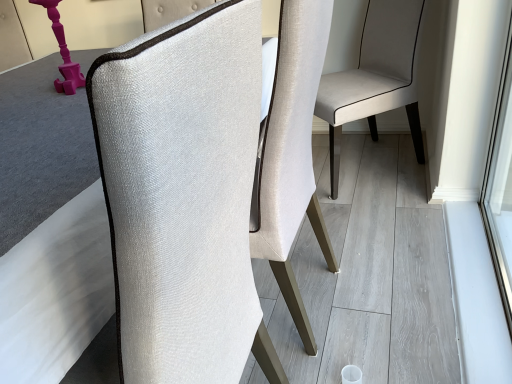
The width and height of the screenshot is (512, 384). What are the coordinates of `matte pink plastic table lamp at left` in the screenshot? It's located at (62, 52).

Image resolution: width=512 pixels, height=384 pixels. Identify the location of textured beige chair at center, which ranks as the 1th chair in back-to-front order. (376, 77).

Find the location of a particular element. This screenshot has width=512, height=384. matte pink plastic table lamp at left is located at coordinates (62, 52).

Considering the relative sizes of textured fabric chair at center, placed as the 1th chair when sorted from front to back, and textured beige chair at center, placed as the second chair when sorted from front to back, in the image provided, is textured fabric chair at center, placed as the 1th chair when sorted from front to back, taller than textured beige chair at center, placed as the second chair when sorted from front to back,?

Indeed, textured fabric chair at center, placed as the 1th chair when sorted from front to back, has a greater height compared to textured beige chair at center, placed as the second chair when sorted from front to back.

How far apart are textured fabric chair at center, the second chair positioned from the back, and textured beige chair at center, placed as the second chair when sorted from front to back?

textured fabric chair at center, the second chair positioned from the back, is 39.12 inches from textured beige chair at center, placed as the second chair when sorted from front to back.

How many degrees apart are the facing directions of textured fabric chair at center, the second chair positioned from the back, and textured beige chair at center, which ranks as the 1th chair in back-to-front order?

The angle between the facing direction of textured fabric chair at center, the second chair positioned from the back, and the facing direction of textured beige chair at center, which ranks as the 1th chair in back-to-front order, is 40.5 degrees.

Locate an element on the screen. The height and width of the screenshot is (384, 512). chair behind the textured fabric chair at center, the second chair positioned from the back is located at coordinates (376, 77).

Locate an element on the screen. chair above the matte pink plastic table lamp at left (from the image's perspective) is located at coordinates (376, 77).

Considering the sizes of objects textured beige chair at center, which ranks as the 1th chair in back-to-front order, and matte pink plastic table lamp at left in the image provided, who is shorter, textured beige chair at center, which ranks as the 1th chair in back-to-front order, or matte pink plastic table lamp at left?

matte pink plastic table lamp at left.

Which is less distant, (336, 180) or (70, 91)?

Point (336, 180) appears to be farther away from the viewer than point (70, 91).

Consider the image. Is textured fabric chair at center, the second chair positioned from the back, looking in the opposite direction of matte pink plastic table lamp at left?

No.

Who is bigger, textured fabric chair at center, placed as the 1th chair when sorted from front to back, or matte pink plastic table lamp at left?

With larger size is textured fabric chair at center, placed as the 1th chair when sorted from front to back.

Are textured fabric chair at center, the second chair positioned from the back, and matte pink plastic table lamp at left far apart?

They are positioned close to each other.

Is textured fabric chair at center, the second chair positioned from the back, spatially inside matte pink plastic table lamp at left, or outside of it?

textured fabric chair at center, the second chair positioned from the back, is located beyond the bounds of matte pink plastic table lamp at left.

Are matte pink plastic table lamp at left and textured fabric chair at center, placed as the 1th chair when sorted from front to back, far apart?

That's not correct — matte pink plastic table lamp at left is a little close to textured fabric chair at center, placed as the 1th chair when sorted from front to back.

From the image's perspective, does matte pink plastic table lamp at left appear higher than textured fabric chair at center, the second chair positioned from the back?

Correct, matte pink plastic table lamp at left appears higher than textured fabric chair at center, the second chair positioned from the back, in the image.

Is matte pink plastic table lamp at left not within textured fabric chair at center, the second chair positioned from the back?

matte pink plastic table lamp at left lies outside textured fabric chair at center, the second chair positioned from the back,'s area.

Find the location of a particular element. Image resolution: width=512 pixels, height=384 pixels. chair in front of the matte pink plastic table lamp at left is located at coordinates (203, 187).

From the image's perspective, is textured beige chair at center, placed as the second chair when sorted from front to back, above or below textured fabric chair at center, placed as the 1th chair when sorted from front to back?

textured beige chair at center, placed as the second chair when sorted from front to back, is above textured fabric chair at center, placed as the 1th chair when sorted from front to back.

Is point (379, 24) farther from camera compared to point (118, 90)?

Yes, point (379, 24) is farther from viewer.

Between textured beige chair at center, placed as the second chair when sorted from front to back, and textured fabric chair at center, the second chair positioned from the back, which one has smaller size?

Smaller between the two is textured fabric chair at center, the second chair positioned from the back.

Would you say textured beige chair at center, placed as the second chair when sorted from front to back, is to the left or to the right of textured fabric chair at center, the second chair positioned from the back, in the picture?

In the image, textured beige chair at center, placed as the second chair when sorted from front to back, appears on the right side of textured fabric chair at center, the second chair positioned from the back.

Is matte pink plastic table lamp at left taller than textured beige chair at center, placed as the second chair when sorted from front to back?

Incorrect, the height of matte pink plastic table lamp at left is not larger of that of textured beige chair at center, placed as the second chair when sorted from front to back.

Does matte pink plastic table lamp at left have a smaller size compared to textured beige chair at center, placed as the second chair when sorted from front to back?

Yes.

You are a GUI agent. You are given a task and a screenshot of the screen. Output one action in this format:
    pyautogui.click(x=<x>, y=<y>)
    Task: Click on the 2nd chair to the right of the matte pink plastic table lamp at left, starting your count from the anchor
    The image size is (512, 384).
    Given the screenshot: What is the action you would take?
    pyautogui.click(x=376, y=77)

Relative to textured beige chair at center, placed as the second chair when sorted from front to back, is matte pink plastic table lamp at left in front or behind?

matte pink plastic table lamp at left is positioned closer to the viewer than textured beige chair at center, placed as the second chair when sorted from front to back.

You are a GUI agent. You are given a task and a screenshot of the screen. Output one action in this format:
    pyautogui.click(x=<x>, y=<y>)
    Task: Click on the chair located on the right of textured fabric chair at center, the second chair positioned from the back
    Image resolution: width=512 pixels, height=384 pixels.
    Given the screenshot: What is the action you would take?
    pyautogui.click(x=376, y=77)

The height and width of the screenshot is (384, 512). Identify the location of chair behind the matte pink plastic table lamp at left. (376, 77).

Estimate the real-world distances between objects in this image. Which object is further from matte pink plastic table lamp at left, textured beige chair at center, placed as the second chair when sorted from front to back, or textured fabric chair at center, the second chair positioned from the back?

textured beige chair at center, placed as the second chair when sorted from front to back, lies further to matte pink plastic table lamp at left than the other object.

Looking at the image, which one is located further to textured beige chair at center, which ranks as the 1th chair in back-to-front order, textured fabric chair at center, placed as the 1th chair when sorted from front to back, or matte pink plastic table lamp at left?

matte pink plastic table lamp at left lies further to textured beige chair at center, which ranks as the 1th chair in back-to-front order, than the other object.

From the image, which object appears to be nearer to textured beige chair at center, which ranks as the 1th chair in back-to-front order, matte pink plastic table lamp at left or textured fabric chair at center, placed as the 1th chair when sorted from front to back?

textured fabric chair at center, placed as the 1th chair when sorted from front to back, lies closer to textured beige chair at center, which ranks as the 1th chair in back-to-front order, than the other object.

From the image, which object appears to be nearer to textured fabric chair at center, placed as the 1th chair when sorted from front to back, matte pink plastic table lamp at left or textured beige chair at center, placed as the second chair when sorted from front to back?

matte pink plastic table lamp at left lies closer to textured fabric chair at center, placed as the 1th chair when sorted from front to back, than the other object.

When comparing their distances from textured fabric chair at center, placed as the 1th chair when sorted from front to back, does textured beige chair at center, which ranks as the 1th chair in back-to-front order, or matte pink plastic table lamp at left seem closer?

matte pink plastic table lamp at left is positioned closer to the anchor textured fabric chair at center, placed as the 1th chair when sorted from front to back.

Which object lies nearer to the anchor point matte pink plastic table lamp at left, textured fabric chair at center, the second chair positioned from the back, or textured beige chair at center, which ranks as the 1th chair in back-to-front order?

textured fabric chair at center, the second chair positioned from the back, is closer to matte pink plastic table lamp at left.

The image size is (512, 384). Identify the location of chair located between matte pink plastic table lamp at left and textured beige chair at center, placed as the second chair when sorted from front to back, in the left-right direction. (203, 187).